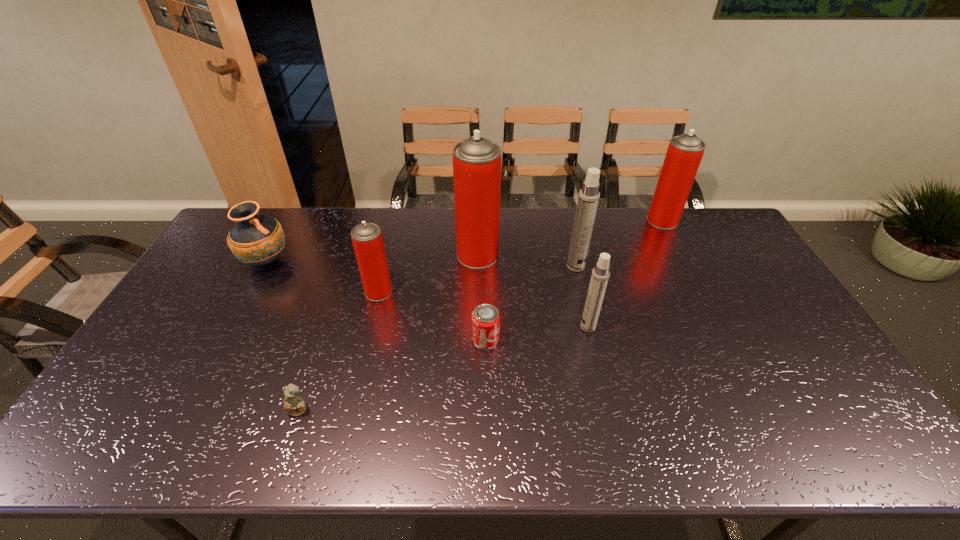
The height and width of the screenshot is (540, 960). Identify the location of vacant space at the far left corner. pos(220,238).

Identify the location of vacant space at the far right corner of the desktop. (735, 231).

The height and width of the screenshot is (540, 960). Find the location of `free spot between the bigger white aerosol can and the pottery`. free spot between the bigger white aerosol can and the pottery is located at coordinates (420, 264).

This screenshot has width=960, height=540. In order to click on vacant area that lies between the tallest object and the rightmost object in this screenshot , I will do `click(570, 238)`.

You are a GUI agent. You are given a task and a screenshot of the screen. Output one action in this format:
    pyautogui.click(x=<x>, y=<y>)
    Task: Click on the free point between the farther white aerosol can and the farthest aerosol can
    This screenshot has width=960, height=540.
    Given the screenshot: What is the action you would take?
    pyautogui.click(x=619, y=244)

The image size is (960, 540). In order to click on free space between the biggest red aerosol can and the nearer white aerosol can in this screenshot , I will do `click(533, 291)`.

At what (x,y) coordinates should I click in order to perform the action: click on empty space between the second shortest object and the farthest red aerosol can. Please return your answer as a coordinate pair (x, y). The height and width of the screenshot is (540, 960). Looking at the image, I should click on (574, 280).

The width and height of the screenshot is (960, 540). Identify the location of free spot between the farthest object and the smallest red aerosol can. (520, 256).

Find the location of a particular element. free space between the second nearest red aerosol can and the red can is located at coordinates [x=482, y=297].

Where is `vacant space that is in between the second aerosol can from left to right and the farthest aerosol can`? vacant space that is in between the second aerosol can from left to right and the farthest aerosol can is located at coordinates (570, 238).